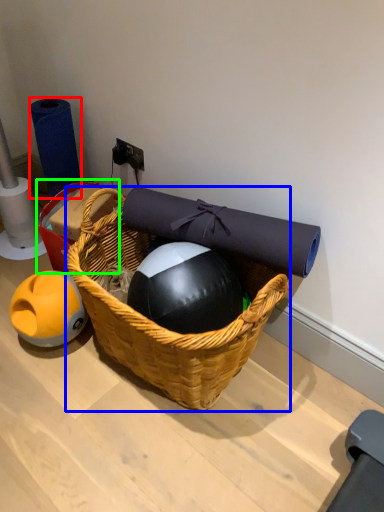
Question: Considering the real-world distances, which object is farthest from toilet paper (highlighted by a red box)? picnic basket (highlighted by a blue box) or basket (highlighted by a green box)?

Choices:
 (A) picnic basket
 (B) basket

Answer: (A)